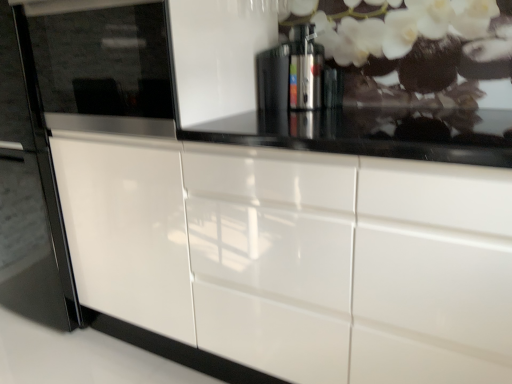
Question: Can we say glossy black microwave at left lies outside glossy white fridge at left?

Choices:
 (A) no
 (B) yes

Answer: (B)

Question: Is glossy black microwave at left looking in the opposite direction of glossy white fridge at left?

Choices:
 (A) yes
 (B) no

Answer: (B)

Question: Is glossy black microwave at left to the left of glossy white fridge at left from the viewer's perspective?

Choices:
 (A) no
 (B) yes

Answer: (A)

Question: Is glossy black microwave at left further to camera compared to glossy white fridge at left?

Choices:
 (A) no
 (B) yes

Answer: (A)

Question: Could you tell me if glossy black microwave at left is facing glossy white fridge at left?

Choices:
 (A) no
 (B) yes

Answer: (A)

Question: Is point (437, 297) closer or farther from the camera than point (53, 201)?

Choices:
 (A) farther
 (B) closer

Answer: (B)

Question: In terms of size, does glossy white cabinet at center appear bigger or smaller than glossy white fridge at left?

Choices:
 (A) small
 (B) big

Answer: (B)

Question: Choose the correct answer: Is glossy white cabinet at center inside glossy white fridge at left or outside it?

Choices:
 (A) inside
 (B) outside

Answer: (B)

Question: Considering the positions of glossy white cabinet at center and glossy white fridge at left in the image, is glossy white cabinet at center taller or shorter than glossy white fridge at left?

Choices:
 (A) tall
 (B) short

Answer: (B)

Question: Based on their sizes in the image, would you say glossy white fridge at left is bigger or smaller than glossy white cabinet at center?

Choices:
 (A) small
 (B) big

Answer: (A)

Question: Would you say glossy white fridge at left is inside or outside glossy white cabinet at center?

Choices:
 (A) outside
 (B) inside

Answer: (A)

Question: In terms of height, does glossy white fridge at left look taller or shorter compared to glossy white cabinet at center?

Choices:
 (A) tall
 (B) short

Answer: (A)

Question: Based on their positions, is glossy white fridge at left located to the left or right of glossy white cabinet at center?

Choices:
 (A) right
 (B) left

Answer: (B)

Question: Is point (298, 49) positioned closer to the camera than point (310, 299)?

Choices:
 (A) closer
 (B) farther

Answer: (B)

Question: In the image, is satin silver coffee machine at center positioned in front of or behind glossy white cabinet at center?

Choices:
 (A) front
 (B) behind

Answer: (B)